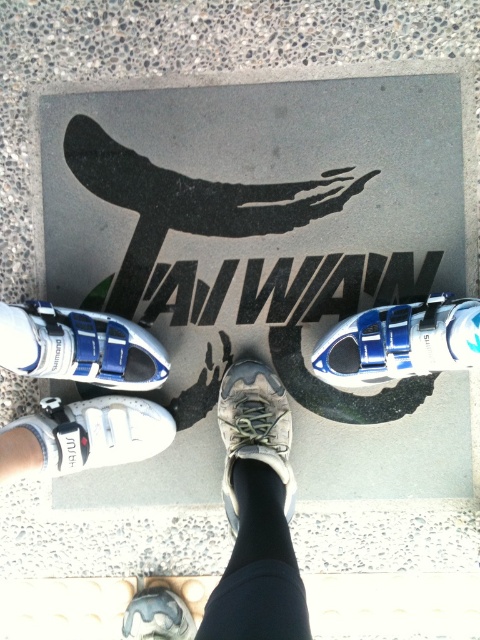
Question: Which point is farther to the camera?

Choices:
 (A) white synthetic shoe at left
 (B) blue matte cycling shoe at center
 (C) white synthetic shoe at lower left
 (D) gray rubber shoe at center

Answer: (D)

Question: Which object is positioned farthest from the camouflage fabric sneaker at center?

Choices:
 (A) blue matte cycling shoe at center
 (B) white synthetic shoe at left
 (C) gray rubber shoe at center
 (D) white synthetic shoe at lower left

Answer: (C)

Question: From the image, what is the correct spatial relationship of white synthetic shoe at left in relation to white synthetic shoe at lower left?

Choices:
 (A) left
 (B) right

Answer: (B)

Question: Which object is the closest to the white synthetic shoe at lower left?

Choices:
 (A) white synthetic shoe at left
 (B) blue matte cycling shoe at center
 (C) gray rubber shoe at center

Answer: (A)

Question: Is blue matte cycling shoe at center in front of camouflage fabric sneaker at center?

Choices:
 (A) yes
 (B) no

Answer: (A)

Question: Does camouflage fabric sneaker at center appear under gray rubber shoe at center?

Choices:
 (A) no
 (B) yes

Answer: (A)